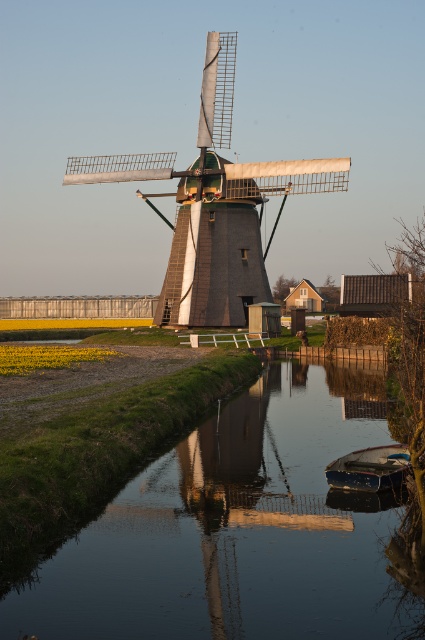
You are an architect designing a scale model of this scene. The wooden windmill at center and the blue wooden boat at lower right must be included. Which object should be wider in your model to stay true to the original image?

The wooden windmill at center should be wider in the model since its width is larger than the blue wooden boat at lower right in the original image.

You are standing at point (x=214, y=204) in the rural scene. What object are you directly at?

You are directly at the wooden windmill at center located at point (x=214, y=204).